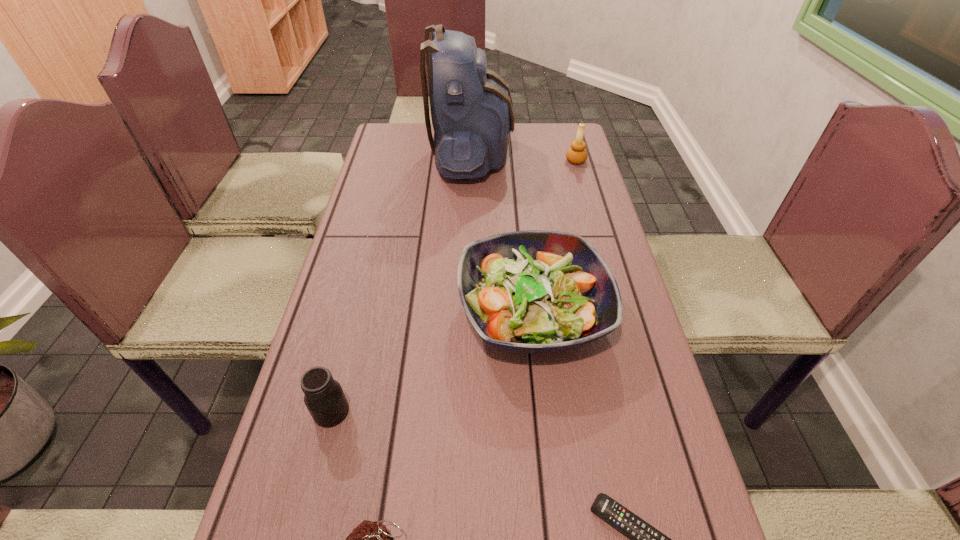
At what (x,y) coordinates should I click in order to perform the action: click on backpack. Please return your answer as a coordinate pair (x, y). The height and width of the screenshot is (540, 960). Looking at the image, I should click on (471, 106).

Locate an element on the screen. Image resolution: width=960 pixels, height=540 pixels. candle_holder is located at coordinates (577, 154).

I want to click on salad plate, so click(535, 291).

I want to click on jar, so click(324, 398).

This screenshot has height=540, width=960. I want to click on the fourth farthest object, so click(x=324, y=398).

In order to click on free spot located at the front pocket of the backpack in this screenshot , I will do `click(568, 155)`.

You are a GUI agent. You are given a task and a screenshot of the screen. Output one action in this format:
    pyautogui.click(x=<x>, y=<y>)
    Task: Click on the free space located on the left of the candle_holder
    
    Given the screenshot: What is the action you would take?
    pyautogui.click(x=512, y=161)

In order to click on vacant region located on the left of the salad plate in this screenshot , I will do `click(348, 312)`.

The height and width of the screenshot is (540, 960). Identify the location of free space located on the right of the fourth farthest object. (512, 411).

Identify the location of backpack that is at the far edge. (471, 106).